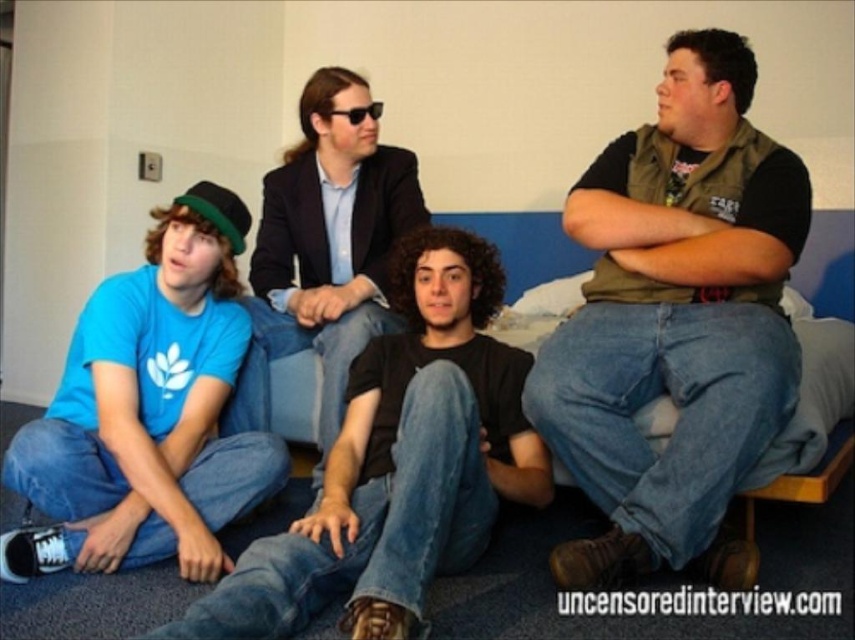
Does satin black blazer at center appear under black plastic sunglasses at center?

Yes.

Which is in front, point (354, 241) or point (355, 120)?

Positioned in front is point (355, 120).

Describe the element at coordinates (323, 250) in the screenshot. I see `satin black blazer at center` at that location.

You are a GUI agent. You are given a task and a screenshot of the screen. Output one action in this format:
    pyautogui.click(x=<x>, y=<y>)
    Task: Click on the satin black blazer at center
    Image resolution: width=855 pixels, height=640 pixels.
    Given the screenshot: What is the action you would take?
    pyautogui.click(x=323, y=250)

Between blue cotton t-shirt at left and black plastic sunglasses at center, which one has more height?

blue cotton t-shirt at left is taller.

Does point (315, 502) come behind point (342, 115)?

That is False.

Is point (399, 458) positioned in front of point (333, 115)?

Yes, point (399, 458) is closer to viewer.

This screenshot has height=640, width=855. I want to click on blue cotton t-shirt at left, so click(x=399, y=465).

Can you confirm if green matte vest at center is bigger than satin black blazer at center?

Indeed, green matte vest at center has a larger size compared to satin black blazer at center.

Between green matte vest at center and satin black blazer at center, which one has less height?

With less height is satin black blazer at center.

Which is in front, point (700, 516) or point (258, 289)?

Point (700, 516) is in front.

Identify the location of green matte vest at center. (674, 316).